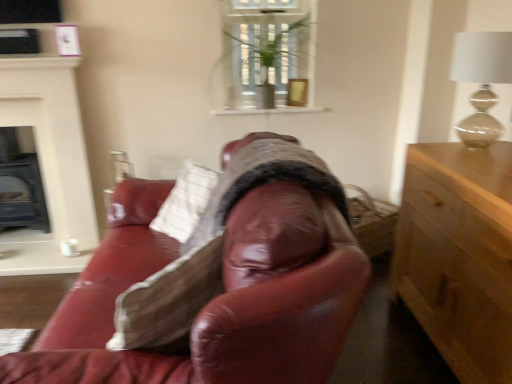
Question: Looking at the image, does light wood cabinet at right seem bigger or smaller compared to matte beige lamp at upper right?

Choices:
 (A) big
 (B) small

Answer: (A)

Question: Considering the positions of point (465, 185) and point (476, 135), is point (465, 185) closer or farther from the camera than point (476, 135)?

Choices:
 (A) closer
 (B) farther

Answer: (A)

Question: Which object is positioned closest to the matte beige lamp at upper right?

Choices:
 (A) white matte candle at left
 (B) light wood cabinet at right
 (C) white painted wood fireplace at left
 (D) green leafy plant at upper center
 (E) matte black fireplace at left

Answer: (B)

Question: Estimate the real-world distances between objects in this image. Which object is closer to the matte beige lamp at upper right?

Choices:
 (A) white matte candle at left
 (B) white painted wood fireplace at left
 (C) light wood cabinet at right
 (D) green leafy plant at upper center
 (E) matte black fireplace at left

Answer: (C)